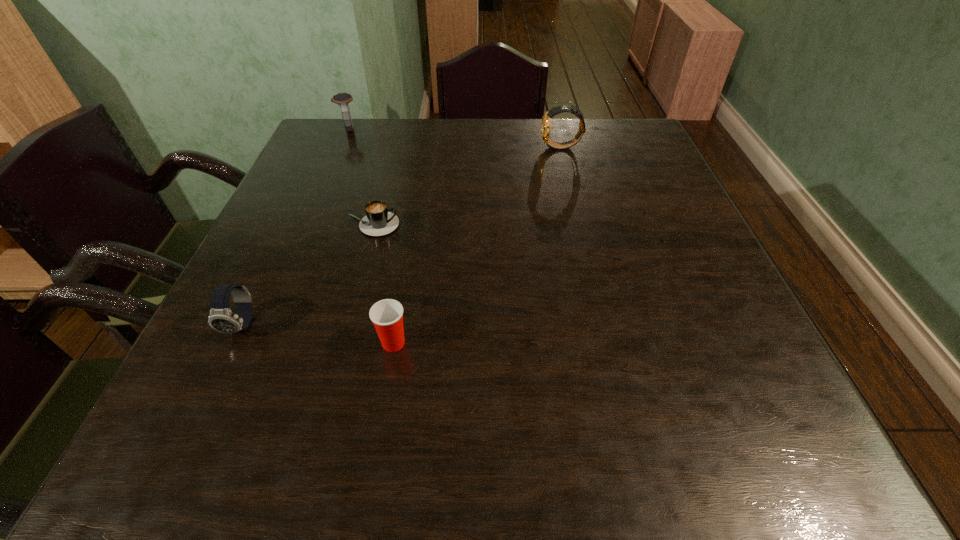
Where is `vacant area situated 0.360m on the front of the farthest watch`? vacant area situated 0.360m on the front of the farthest watch is located at coordinates (311, 218).

This screenshot has height=540, width=960. In order to click on vacant space located 0.190m on the face of the nearest watch in this screenshot , I will do `click(183, 451)`.

At what (x,y) coordinates should I click in order to perform the action: click on vacant region located 0.370m on the right of the Dixie cup. Please return your answer as a coordinate pair (x, y). The width and height of the screenshot is (960, 540). Looking at the image, I should click on click(x=623, y=343).

Locate an element on the screen. This screenshot has height=540, width=960. vacant position located with the handle on the side of the cappuccino is located at coordinates (484, 225).

This screenshot has width=960, height=540. I want to click on object that is at the far left corner, so click(342, 99).

Identify the location of vacant area at the far edge. (549, 154).

Locate an element on the screen. vacant space at the near edge of the desktop is located at coordinates pos(621,440).

In the image, there is a desktop. What are the coordinates of `vacant space at the left edge` in the screenshot? It's located at (325, 256).

Where is `free space at the right edge of the desktop`? free space at the right edge of the desktop is located at coordinates (725, 302).

In the image, there is a desktop. Where is `vacant region at the near right corner`? vacant region at the near right corner is located at coordinates (706, 451).